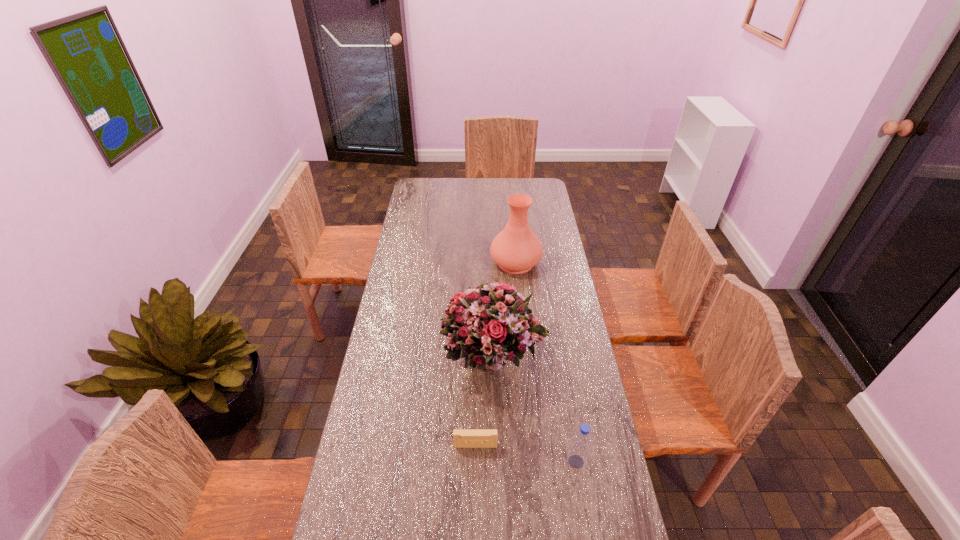
Image resolution: width=960 pixels, height=540 pixels. In order to click on the third closest object to the nearest object in this screenshot , I will do `click(516, 249)`.

Select which object is the second closest to the second farthest object. Please provide its 2D coordinates. Your answer should be formatted as a tuple, i.e. [(x, y)], where the tuple contains the x and y coordinates of a point satisfying the conditions above.

[(578, 453)]

At what (x,y) coordinates should I click in order to perform the action: click on vacant space that satisfies the following two spatial constraints: 1. at the front of the second nearest object with spools; 2. on the right side of the nearest object. Please return your answer as a coordinate pair (x, y). Looking at the image, I should click on [x=475, y=462].